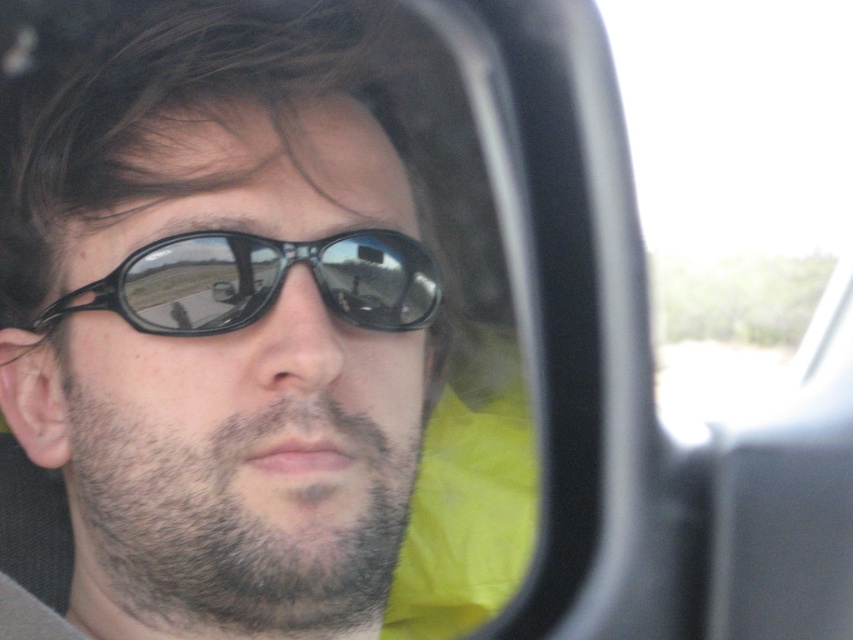
You are a passenger in a moving car and notice the transparent glass car window at upper right and the sunglasses at center in the side mirror. Which object is closer to you?

The sunglasses at center are closer to you because the transparent glass car window at upper right is further away in the reflection.